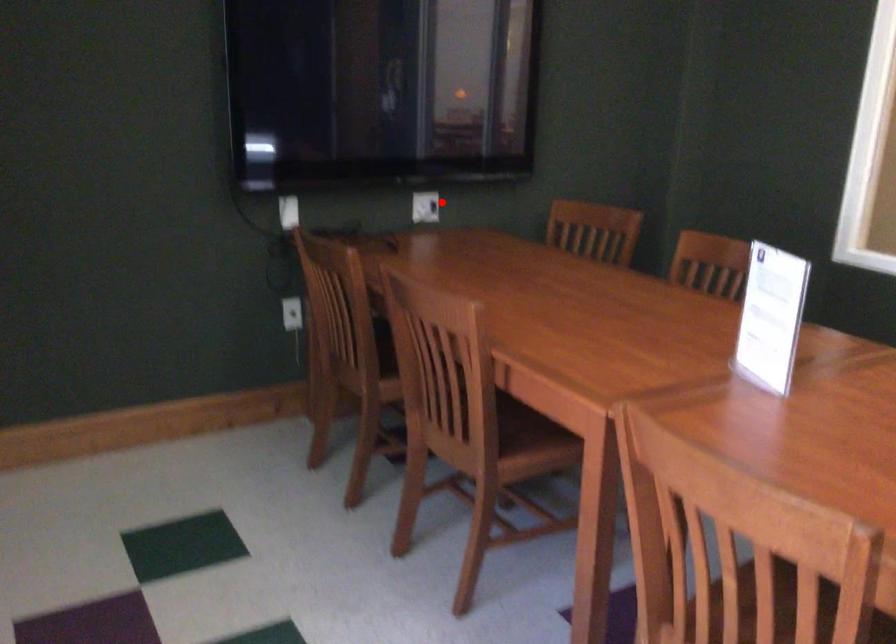
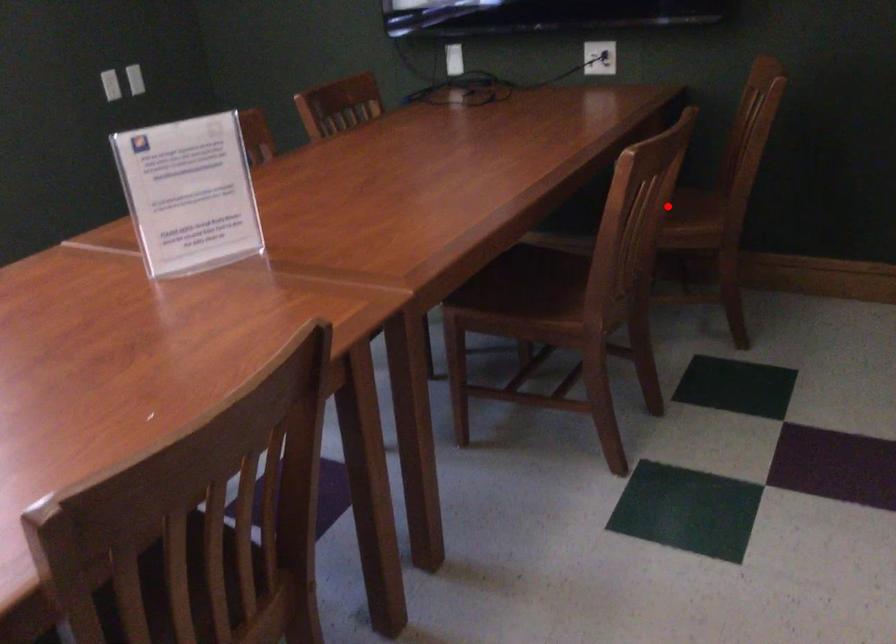
I am providing you with two images of the same scene from different viewpoints. A red point is marked on the first image and another point is marked on the second image. Are the points marked in image1 and image2 representing the same 3D position?

No